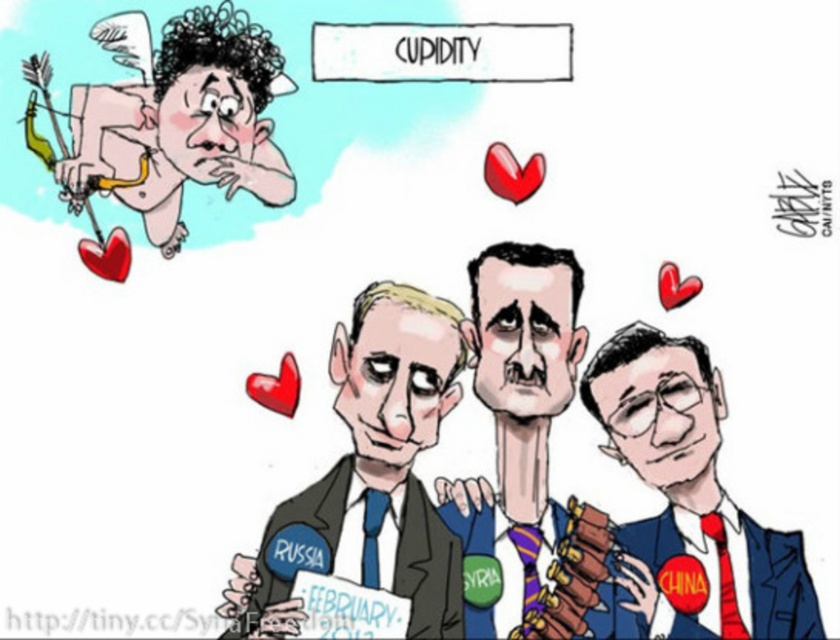
Based on the scene described, which object is positioned to the right of the other? The blue suit at lower right or the dark blue suit at center?

The blue suit at lower right is positioned to the right of the dark blue suit at center.

You are an art student analyzing the political cartoon. You notice two points in the image at coordinates point (463, 344) and point (483, 355). Which point appears closer to the viewer?

Point (463, 344) is closer to the viewer than point (483, 355).

In the scene shown: You are an art student analyzing a political cartoon. The cartoon has two points marked in it. The first point is at coordinates point (665, 355), and the second point is at coordinates point (528, 444). Which of these two points appears closer to the viewer in the image?

Point (665, 355) is closer to the camera than point (528, 444), so it appears closer to the viewer.